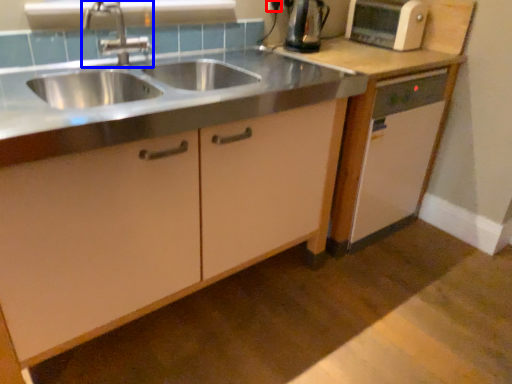
Question: Among these objects, which one is farthest to the camera, electric outlet (highlighted by a red box) or tap (highlighted by a blue box)?

Choices:
 (A) electric outlet
 (B) tap

Answer: (A)